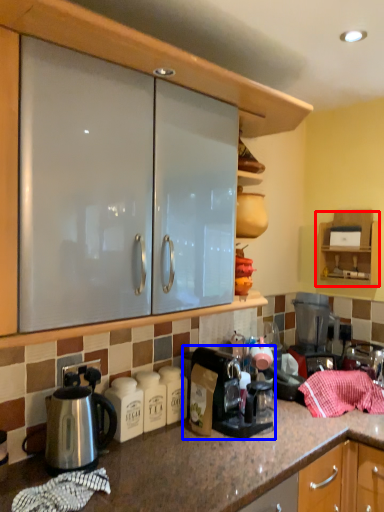
Question: Which of the following is the farthest to the observer, cabinetry (highlighted by a red box) or coffee maker (highlighted by a blue box)?

Choices:
 (A) cabinetry
 (B) coffee maker

Answer: (A)